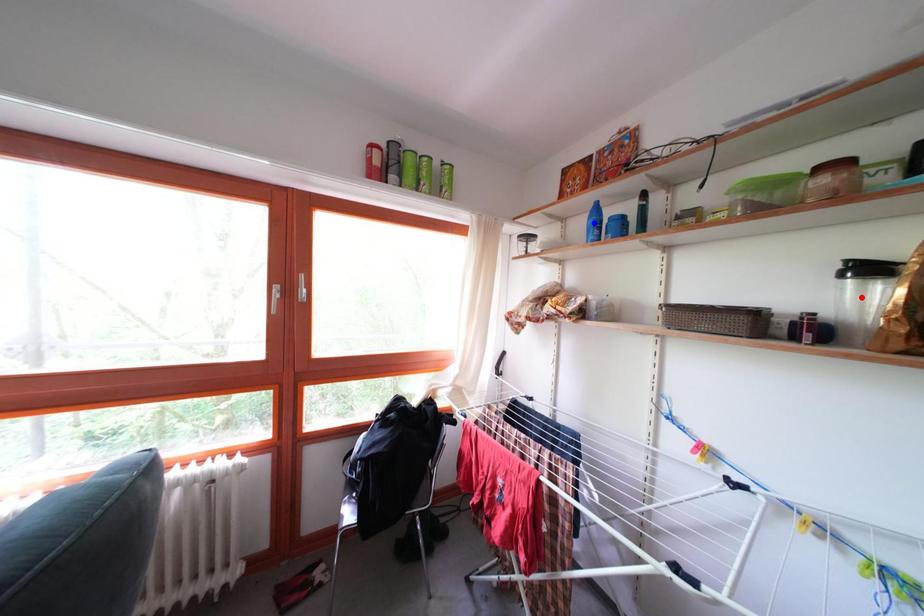
Question: In the image, two points are highlighted. Which point is nearer to the camera? Reply with the corresponding letter.

Choices:
 (A) blue point
 (B) red point

Answer: (B)